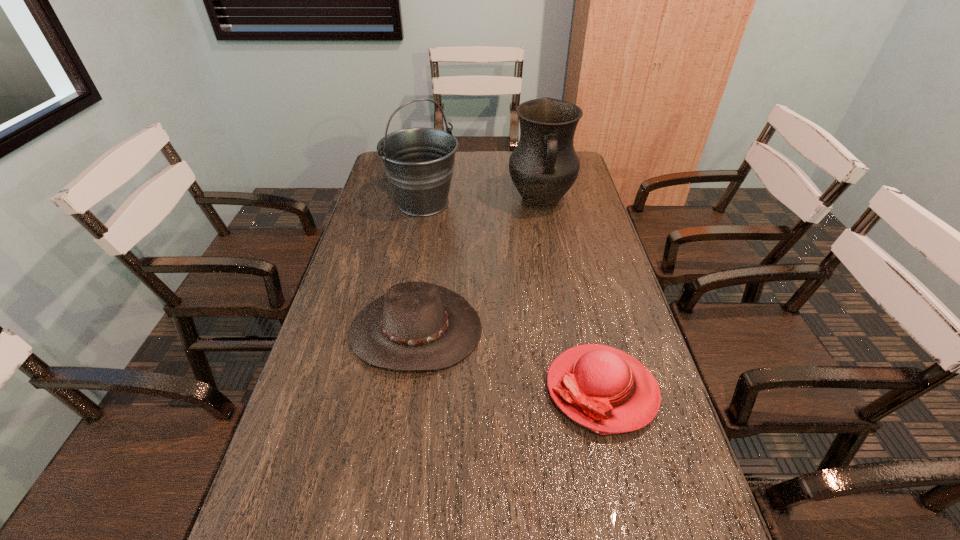
This screenshot has width=960, height=540. I want to click on bucket, so click(x=419, y=162).

You are a GUI agent. You are given a task and a screenshot of the screen. Output one action in this format:
    pyautogui.click(x=<x>, y=<y>)
    Task: Click on the pitcher
    
    Given the screenshot: What is the action you would take?
    pyautogui.click(x=544, y=166)

Locate an element on the screen. The height and width of the screenshot is (540, 960). the left hat is located at coordinates (415, 326).

The height and width of the screenshot is (540, 960). In order to click on the taller hat in this screenshot , I will do `click(415, 326)`.

The height and width of the screenshot is (540, 960). Find the location of `the shortest object`. the shortest object is located at coordinates (604, 389).

Find the location of a particular element. This screenshot has width=960, height=540. the right hat is located at coordinates (604, 389).

The image size is (960, 540). I want to click on vacant space located on the right of the bucket, so click(520, 203).

Find the location of a particular element. vacant region located on the handle side of the pitcher is located at coordinates click(546, 231).

Locate an element on the screen. free spot located 0.110m on the front-facing side of the third tallest object is located at coordinates (403, 419).

Locate an element on the screen. The image size is (960, 540). blank space located 0.130m at the front of the shorter hat with a bow is located at coordinates (491, 389).